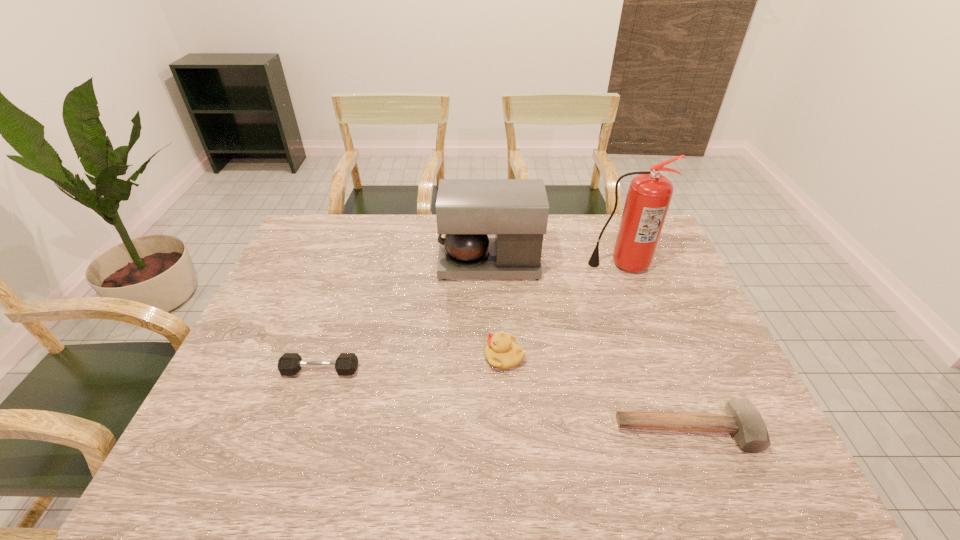
You are a GUI agent. You are given a task and a screenshot of the screen. Output one action in this format:
    pyautogui.click(x=<x>, y=<y>)
    Task: Click on the free space that satisfies the following two spatial constraints: 1. on the instruction side of the tallest object; 2. on the right side of the mallet
    This screenshot has height=540, width=960.
    Given the screenshot: What is the action you would take?
    pyautogui.click(x=684, y=431)

Locate an element on the screen. The image size is (960, 540). vacant space that satisfies the following two spatial constraints: 1. on the instruction side of the fire extinguisher; 2. on the front-facing side of the third tallest object is located at coordinates (657, 357).

Where is `free space that satisfies the following two spatial constraints: 1. on the instruction side of the tallest object; 2. on the front-facing side of the third shortest object`? Image resolution: width=960 pixels, height=540 pixels. free space that satisfies the following two spatial constraints: 1. on the instruction side of the tallest object; 2. on the front-facing side of the third shortest object is located at coordinates (657, 357).

Image resolution: width=960 pixels, height=540 pixels. What are the coordinates of `free spot that satisfies the following two spatial constraints: 1. on the instruction side of the fire extinguisher; 2. on the carafe side of the fourth shortest object` in the screenshot? It's located at (621, 264).

This screenshot has width=960, height=540. Find the location of `vacant space that satisfies the following two spatial constraints: 1. on the instruction side of the fire extinguisher; 2. on the carafe side of the fourth shortest object`. vacant space that satisfies the following two spatial constraints: 1. on the instruction side of the fire extinguisher; 2. on the carafe side of the fourth shortest object is located at coordinates (621, 264).

Where is `vacant area in the image that satisfies the following two spatial constraints: 1. on the instruction side of the fire extinguisher; 2. on the front-facing side of the duckling`? The height and width of the screenshot is (540, 960). vacant area in the image that satisfies the following two spatial constraints: 1. on the instruction side of the fire extinguisher; 2. on the front-facing side of the duckling is located at coordinates (657, 357).

Where is `free region that satisfies the following two spatial constraints: 1. on the carafe side of the nearest object; 2. on the right side of the coffee maker`? free region that satisfies the following two spatial constraints: 1. on the carafe side of the nearest object; 2. on the right side of the coffee maker is located at coordinates click(494, 431).